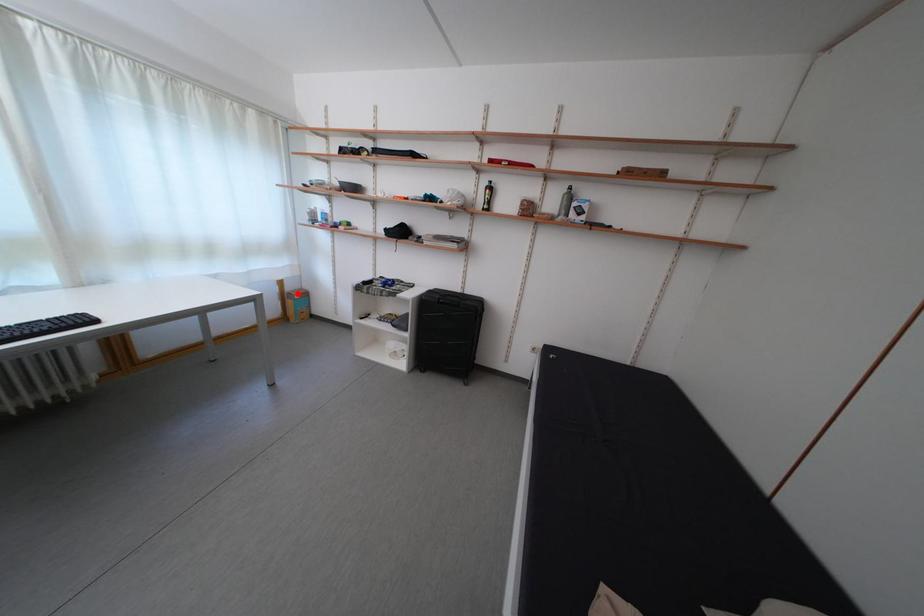
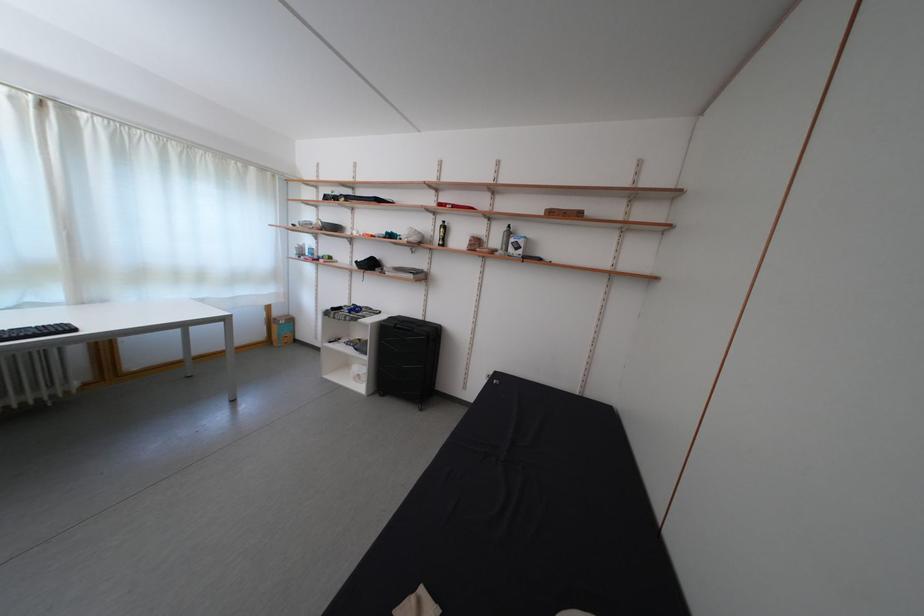
Locate, in the second image, the point that corresponds to the highlighted location in the first image.

(285, 320)